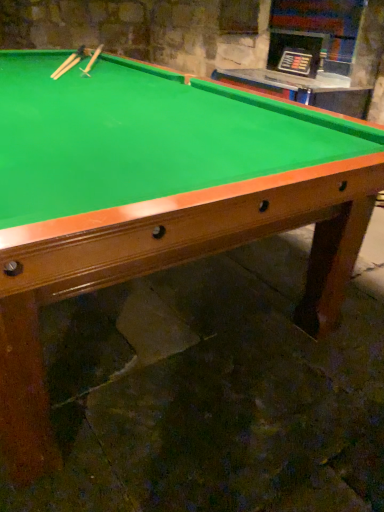
Question: Choose the correct answer: Is wooden cue at upper left, which is the second cue from left to right, inside wooden cue at upper left, which is the first cue in left-to-right order, or outside it?

Choices:
 (A) outside
 (B) inside

Answer: (A)

Question: Does point [102, 46] appear closer or farther from the camera than point [74, 57]?

Choices:
 (A) farther
 (B) closer

Answer: (A)

Question: From a real-world perspective, relative to wooden cue at upper left, which is the first cue in left-to-right order, is wooden cue at upper left, placed as the first cue when sorted from right to left, vertically above or below?

Choices:
 (A) above
 (B) below

Answer: (A)

Question: Looking at the image, does wooden cue at upper left, which is the first cue in left-to-right order, seem bigger or smaller compared to wooden cue at upper left, which is the second cue from left to right?

Choices:
 (A) big
 (B) small

Answer: (B)

Question: From the image's perspective, is wooden cue at upper left, the second cue positioned from the right, positioned above or below wooden cue at upper left, which is the second cue from left to right?

Choices:
 (A) below
 (B) above

Answer: (A)

Question: Considering their positions, is wooden cue at upper left, which is the first cue in left-to-right order, located in front of or behind wooden cue at upper left, which is the second cue from left to right?

Choices:
 (A) front
 (B) behind

Answer: (A)

Question: Considering the positions of wooden cue at upper left, which is the first cue in left-to-right order, and wooden cue at upper left, placed as the first cue when sorted from right to left, in the image, is wooden cue at upper left, which is the first cue in left-to-right order, taller or shorter than wooden cue at upper left, placed as the first cue when sorted from right to left,?

Choices:
 (A) short
 (B) tall

Answer: (A)